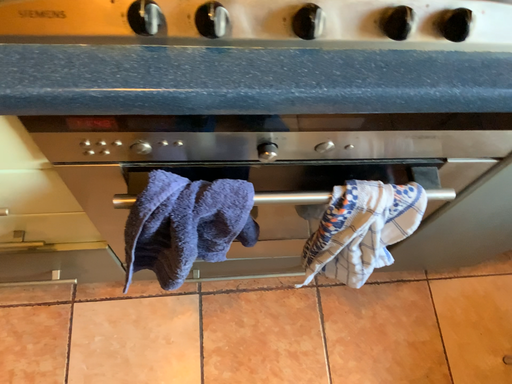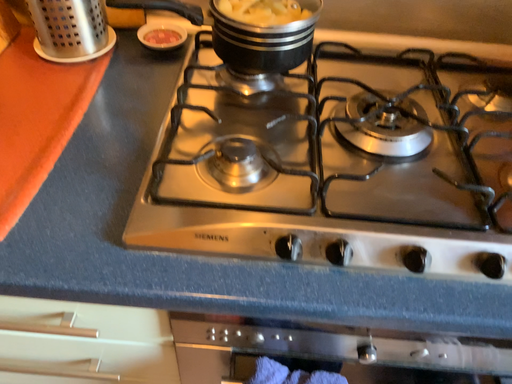
Question: Which way did the camera rotate in the video?

Choices:
 (A) rotated upward
 (B) rotated downward

Answer: (A)